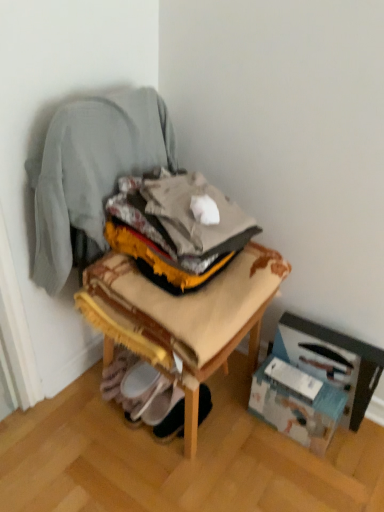
The width and height of the screenshot is (384, 512). In order to click on vacant area situated to the left side of teal cardboard box at lower right, which is the 2th cardboard box in right-to-left order in this screenshot , I will do `click(237, 423)`.